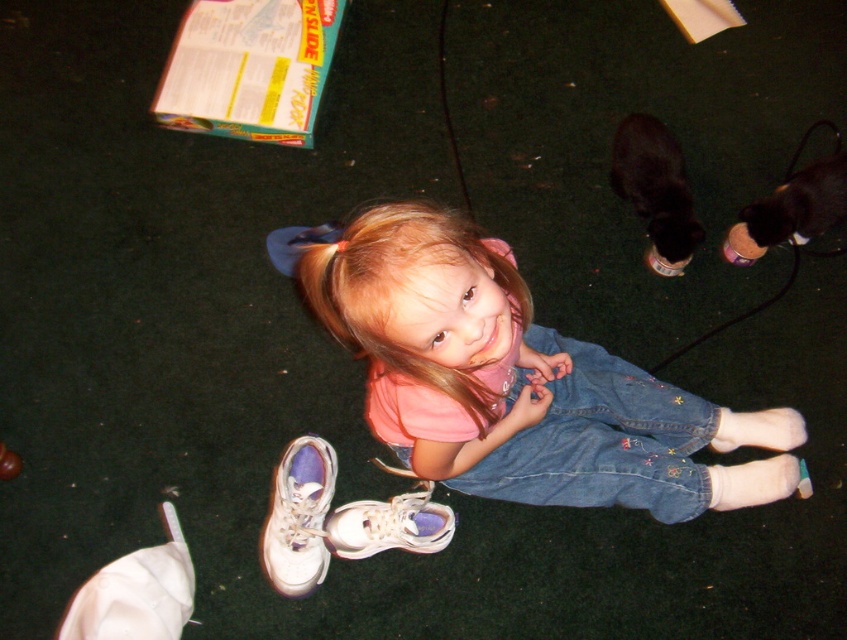
Question: Where is white leather shoe at lower center located in relation to white leather sneaker at lower center in the image?

Choices:
 (A) below
 (B) above

Answer: (B)

Question: Which object is farther from the camera taking this photo?

Choices:
 (A) white leather shoe at lower center
 (B) pink denim dress at center

Answer: (A)

Question: Is pink denim dress at center bigger than denim at center?

Choices:
 (A) yes
 (B) no

Answer: (A)

Question: Is the position of denim at center less distant than that of white leather shoe at lower center?

Choices:
 (A) yes
 (B) no

Answer: (A)

Question: Which object is the farthest from the denim at center?

Choices:
 (A) white leather shoe at lower center
 (B) pink denim dress at center

Answer: (A)

Question: Which object is closer to the camera taking this photo?

Choices:
 (A) pink denim dress at center
 (B) denim at center
 (C) white leather shoe at lower center
 (D) white leather sneaker at lower center

Answer: (A)